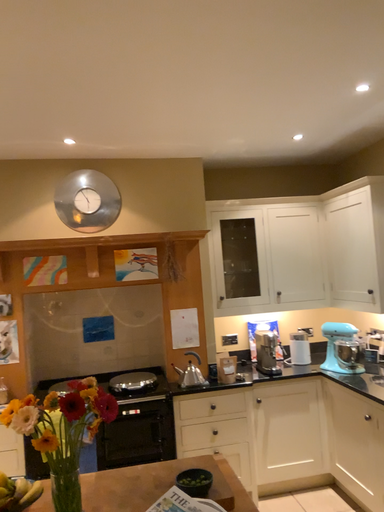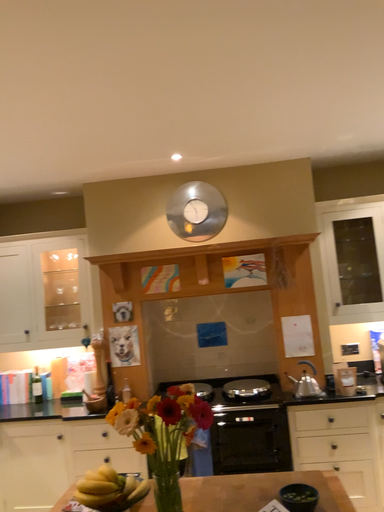
Question: How did the camera likely rotate when shooting the video?

Choices:
 (A) rotated right
 (B) rotated left

Answer: (B)